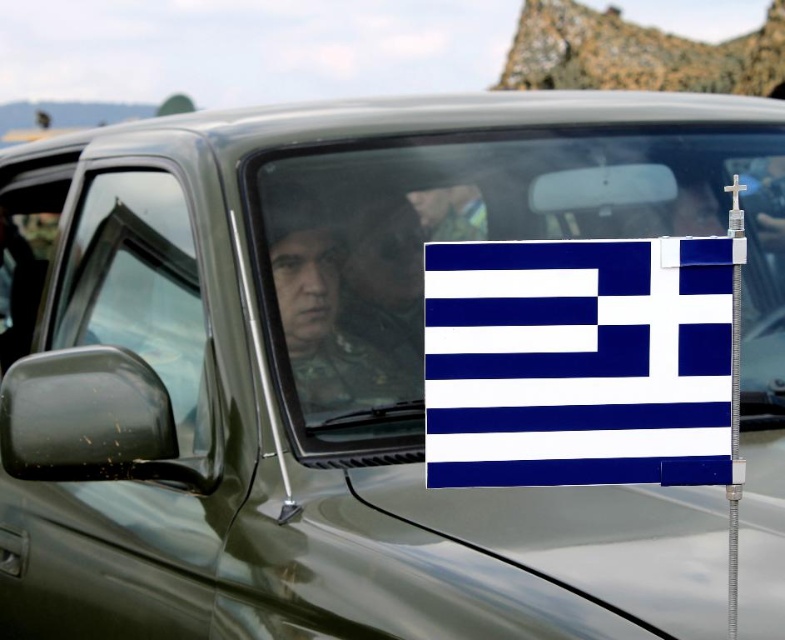
You are a soldier standing next to the military truck. You want to see if you can reach the point at coordinate (141, 292) on the truck. Is this point on a solid or transparent surface?

The point at coordinate (141, 292) is on the transparent glass window at left, so it is on a transparent surface.

You are a photographer standing at the point marked as point (479, 240). You want to take a photo of the white matte flag at center. Is the flag visible in your current position?

The point (479, 240) corresponds to the white matte flag at center, so yes, the flag is visible at your current position.

You are a photographer trying to capture the Greek flag on the blue fabric flag at center and the transparent glass window at left. Which object should you focus on first if you want to ensure both are in the frame without moving the camera?

The blue fabric flag at center should be focused on first because it is smaller than the transparent glass window at left, so it requires more precise framing to ensure it is fully captured in the photo.